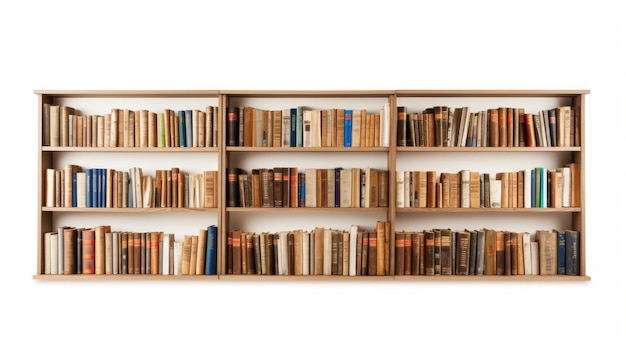
Find the location of a particular element. The image size is (626, 351). shelf is located at coordinates (145, 146), (156, 210), (346, 141), (327, 210), (521, 214), (469, 145), (481, 279), (327, 272), (129, 274).